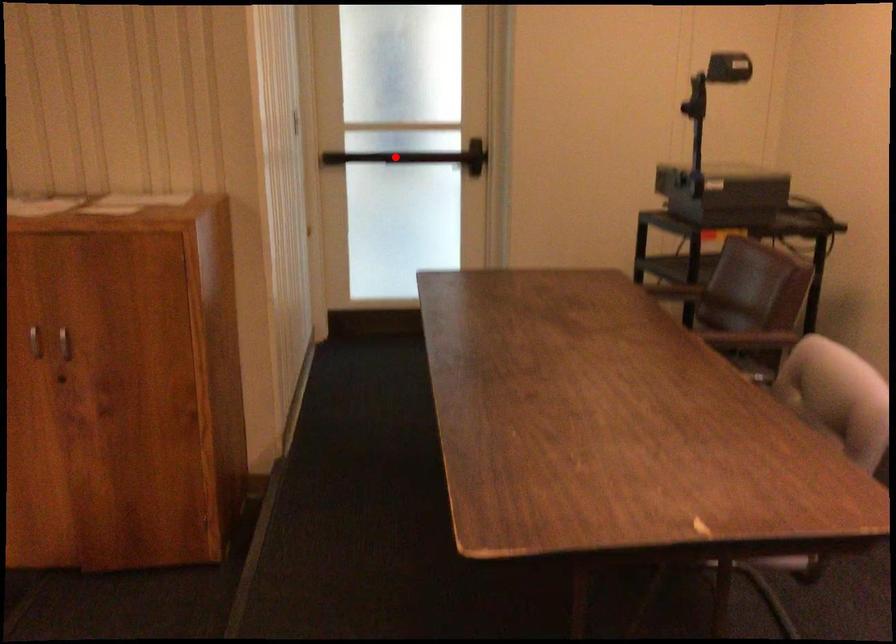
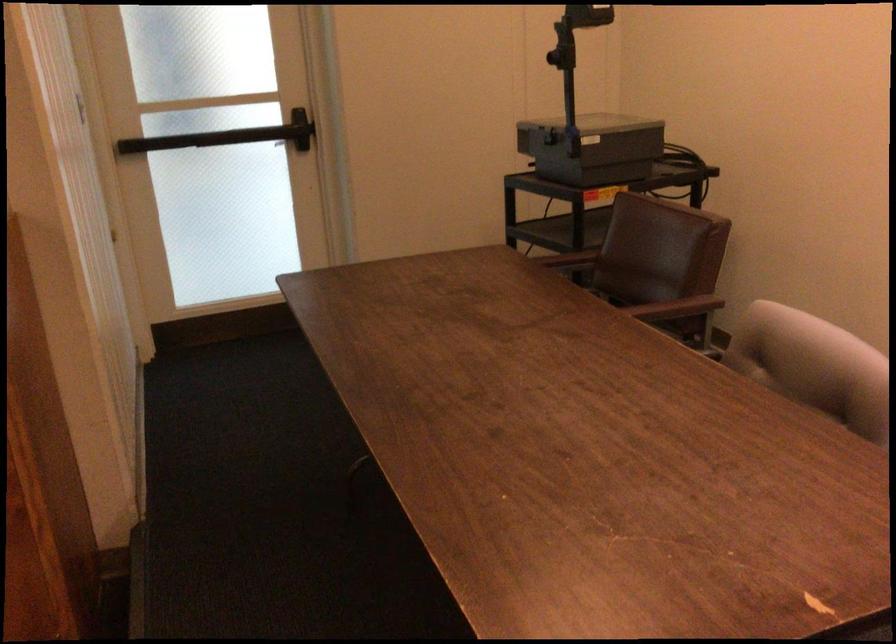
Where in the second image is the point corresponding to the highlighted location from the first image?

(207, 138)